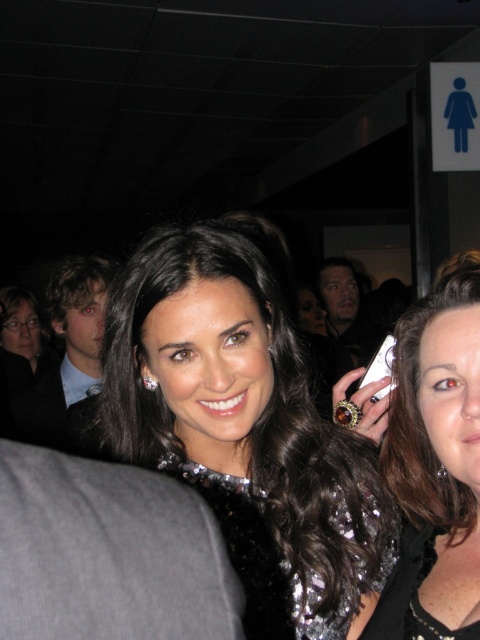
Question: Observing the image, what is the correct spatial positioning of shiny black dress at center in reference to satin black dress at center?

Choices:
 (A) right
 (B) left

Answer: (B)

Question: Does shiny black dress at center lie behind satin black dress at center?

Choices:
 (A) yes
 (B) no

Answer: (A)

Question: Which point is closer to the camera?

Choices:
 (A) shiny black dress at center
 (B) satin black dress at center

Answer: (B)

Question: Does shiny black dress at center appear under satin black dress at center?

Choices:
 (A) yes
 (B) no

Answer: (B)

Question: Which of the following is the farthest from the observer?

Choices:
 (A) (459, 508)
 (B) (152, 456)

Answer: (B)